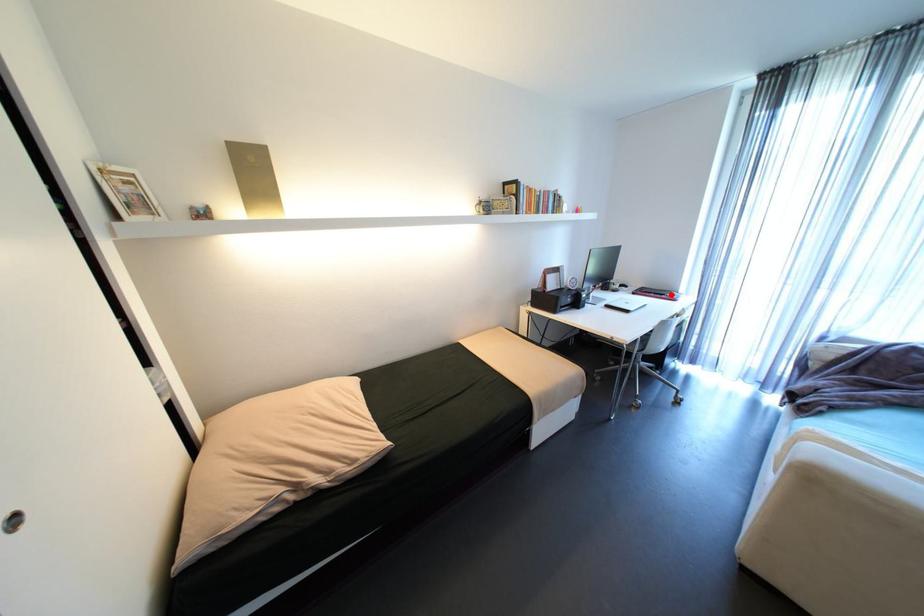
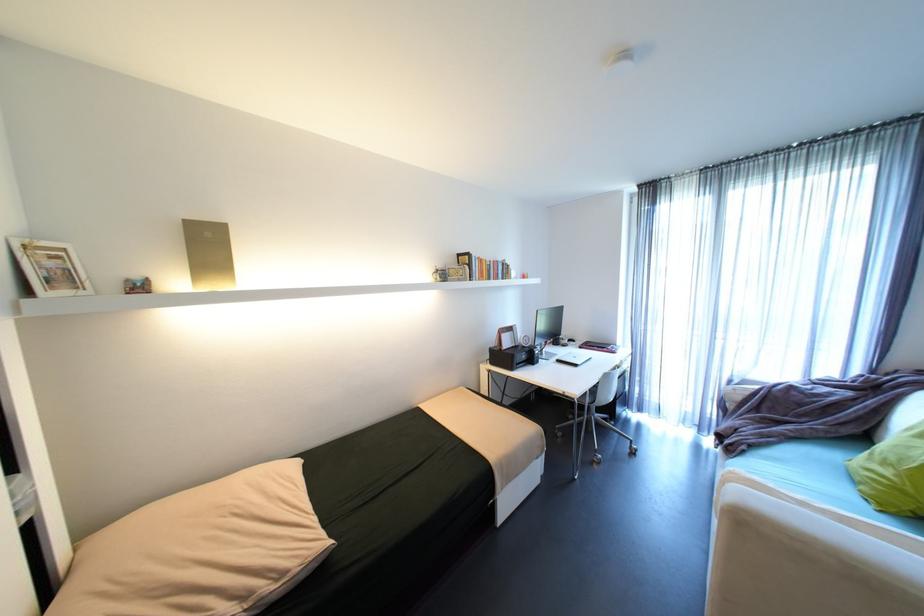
Where in the second image is the point corresponding to the highlighted location from the first image?

(612, 347)